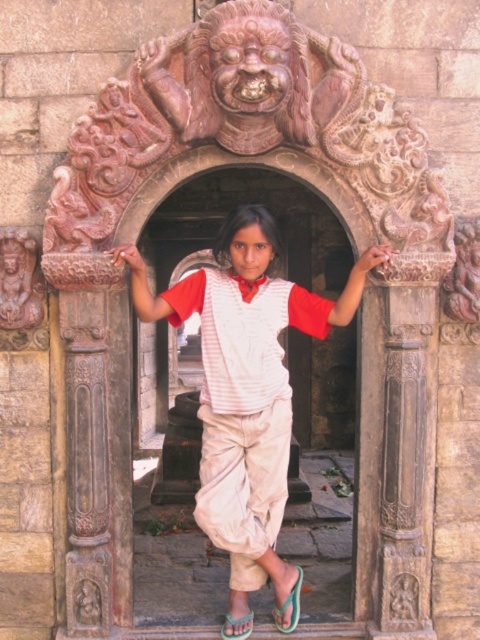
You are a photographer trying to capture the child in the doorway. The camera is set to focus at point 0.6, 0.5. Will the white cotton shirt at center be in focus?

The white cotton shirt at center is at point [245,385], which is very close to the focus point of [240,384]. Therefore, the white cotton shirt at center will be in focus.

Based on the photo, you are a photographer trying to capture the child in the doorway. You notice the white cotton shirt at center and the green fabric sandal at lower center. Which object should you focus on to ensure it takes up more space in your photo?

The white cotton shirt at center should be focused on because it has a greater height compared to the green fabric sandal at lower center, making it larger in the frame.